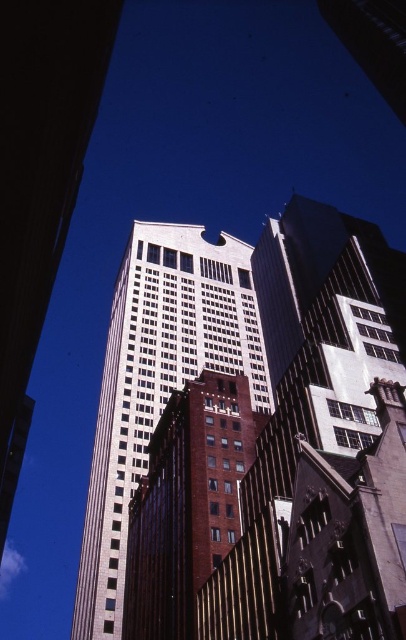
Question: Considering the relative positions of white glass building at center and brown brick building at center in the image provided, where is white glass building at center located with respect to brown brick building at center?

Choices:
 (A) above
 (B) below

Answer: (A)

Question: Can you confirm if white glass building at center is smaller than brown brick building at center?

Choices:
 (A) no
 (B) yes

Answer: (A)

Question: Which object is farther from the camera taking this photo?

Choices:
 (A) white glass building at center
 (B) brown brick building at center

Answer: (A)

Question: Can you confirm if white glass building at center is positioned to the left of brown brick building at center?

Choices:
 (A) yes
 (B) no

Answer: (A)

Question: Which object is closer to the camera taking this photo?

Choices:
 (A) white glass building at center
 (B) brown brick building at center

Answer: (B)